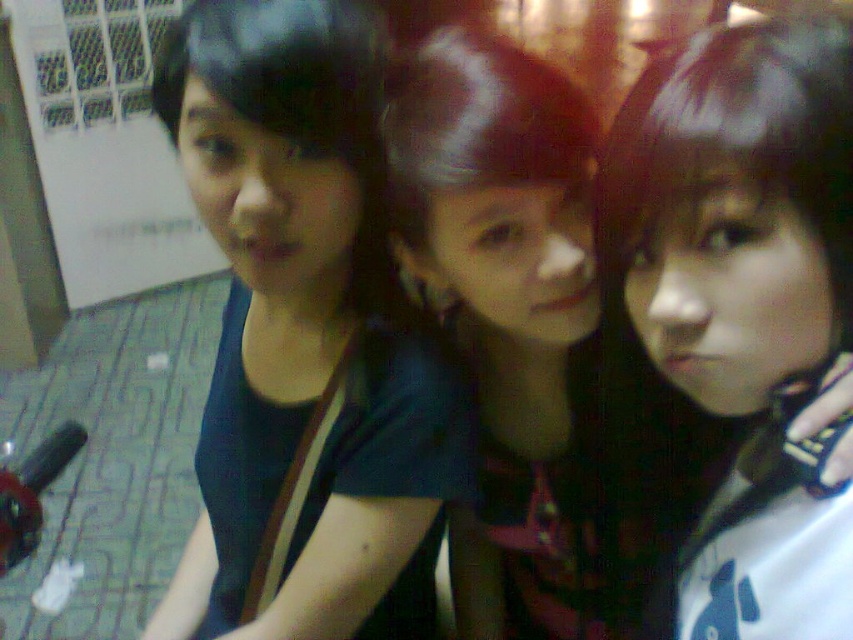
Does matte black hair at center appear on the right side of matte black shirt at center?

Yes, matte black hair at center is to the right of matte black shirt at center.

Does matte black hair at center have a greater width compared to matte black shirt at center?

No.

At what (x,y) coordinates should I click in order to perform the action: click on matte black hair at center. Please return your answer as a coordinate pair (x, y). This screenshot has width=853, height=640. Looking at the image, I should click on (747, 308).